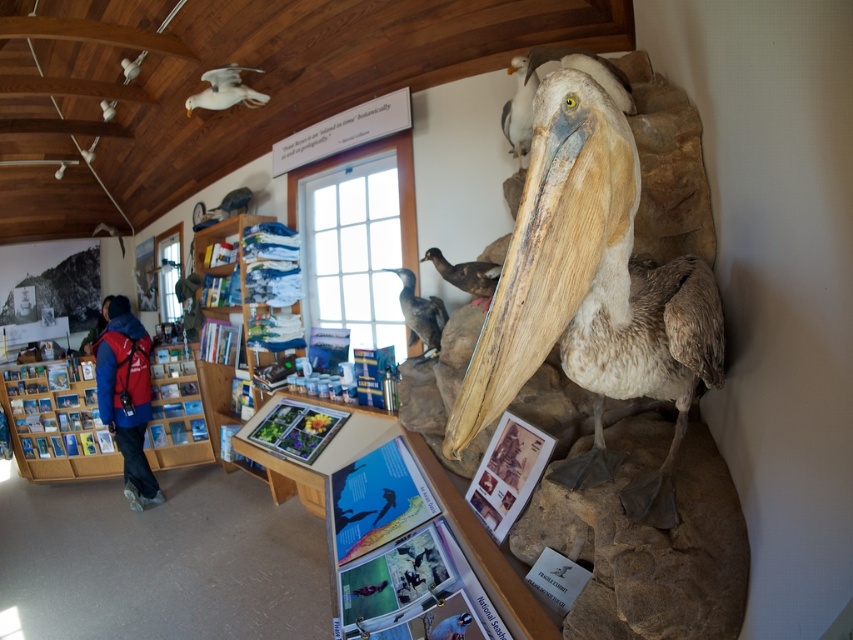
You are an art student sketching the scene. You need to draw the dark gray matte bird at center and the white matte dove at upper left. Which one should you draw first to ensure proper layering?

You should draw the white matte dove at upper left first because the dark gray matte bird at center is in front of it, so you need to layer the dark gray matte bird at center over the dove to maintain the correct spatial relationship.

You are a visitor standing in the museum and want to take a photo of both the blue glossy bird at lower center and the white matte dove at upper left. The camera you have can only focus on objects within a 10 feet range. Will both birds be in focus?

The blue glossy bird at lower center is 9.34 feet away from the white matte dove at upper left. Since the maximum distance between them is under 10 feet, both birds will be within the camera focus range and in focus.

Based on the photo, you are standing in the museum and want to take a photo of the white matte bird at upper left. If your camera can focus on objects up to 2 meters away, will it be able to capture a clear image?

The white matte bird at upper left is 2.46 meters from the viewer. Since the camera can only focus up to 2 meters, it will not be able to capture a clear image because the distance exceeds the camera focus range.